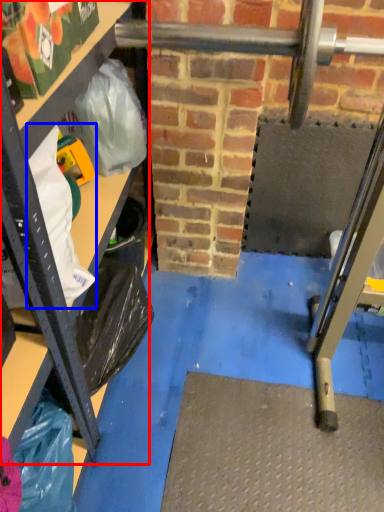
Question: Which of the following is the closest to the observer, shelf (highlighted by a red box) or grocery bag (highlighted by a blue box)?

Choices:
 (A) shelf
 (B) grocery bag

Answer: (A)